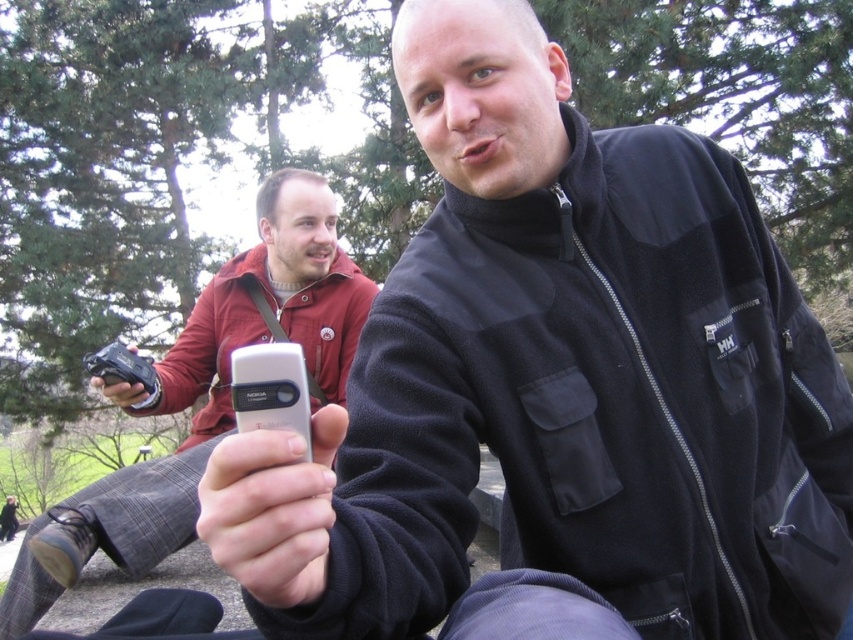
Question: Is matte black jacket at upper right further to the viewer compared to silver metallic phone at center?

Choices:
 (A) yes
 (B) no

Answer: (A)

Question: Does matte black jacket at upper right appear over silver metallic phone at center?

Choices:
 (A) no
 (B) yes

Answer: (A)

Question: Among these objects, which one is nearest to the camera?

Choices:
 (A) silver metallic phone at center
 (B) matte black jacket at upper right

Answer: (A)

Question: Considering the relative positions of matte black jacket at upper right and silver metallic phone at center in the image provided, where is matte black jacket at upper right located with respect to silver metallic phone at center?

Choices:
 (A) below
 (B) above

Answer: (A)

Question: Which point is closer to the camera?

Choices:
 (A) (28, 627)
 (B) (264, 492)

Answer: (B)